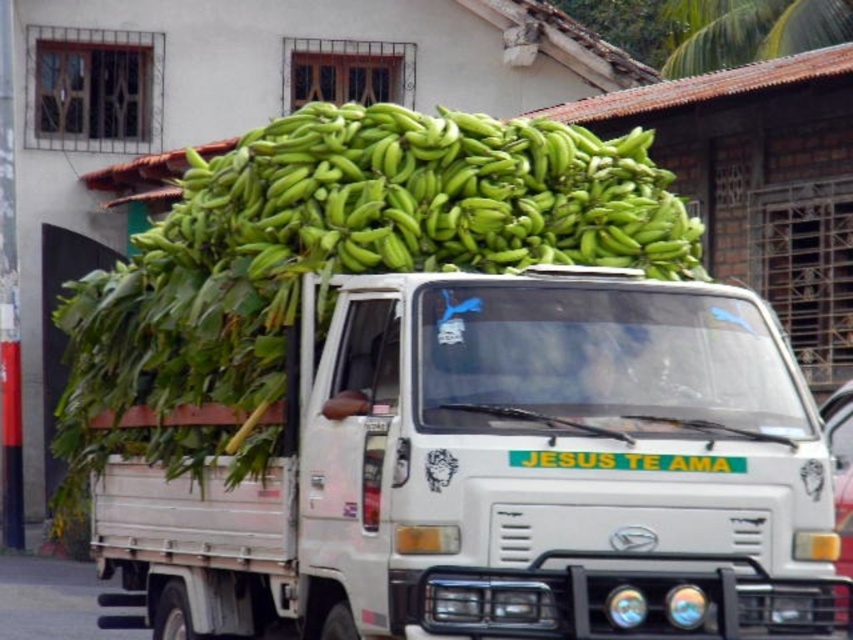
You are a delivery driver who needs to ensure your vehicle can fit through a narrow alleyway that is only 2 meters wide. The white matte truck at center is your vehicle. Can you safely pass through the alleyway while carrying the green matte bananas at center?

The white matte truck at center has a larger size compared to green matte bananas at center. Since the truck itself is larger, it would determine the width needed to pass through the alleyway. If the truck is narrower than 2 meters, it can pass. However, the description does not provide the truck or bananas dimensions, so we cannot confirm if it will fit. More information is needed about the truck width.

You are a pedestrian standing on the sidewalk next to the white matte truck at center. You want to cross the street to the park on the other side. Can you see the green matte bananas at center clearly from your current position?

The white matte truck at center is in front of green matte bananas at center, so the truck is blocking your view of the bananas. You cannot see the green matte bananas at center clearly from your current position.

You are a photographer standing at a certain distance from the white matte truck at center. You want to capture a photo that includes the entire truck without any part being cut off. If your camera has a maximum zoom of 5 meters, will you be able to fit the entire truck into the frame?

The distance between you and the white matte truck at center is 6.02 meters, which exceeds the camera maximum zoom of 5 meters. Therefore, you won only be able to partially capture the truck in the photo.